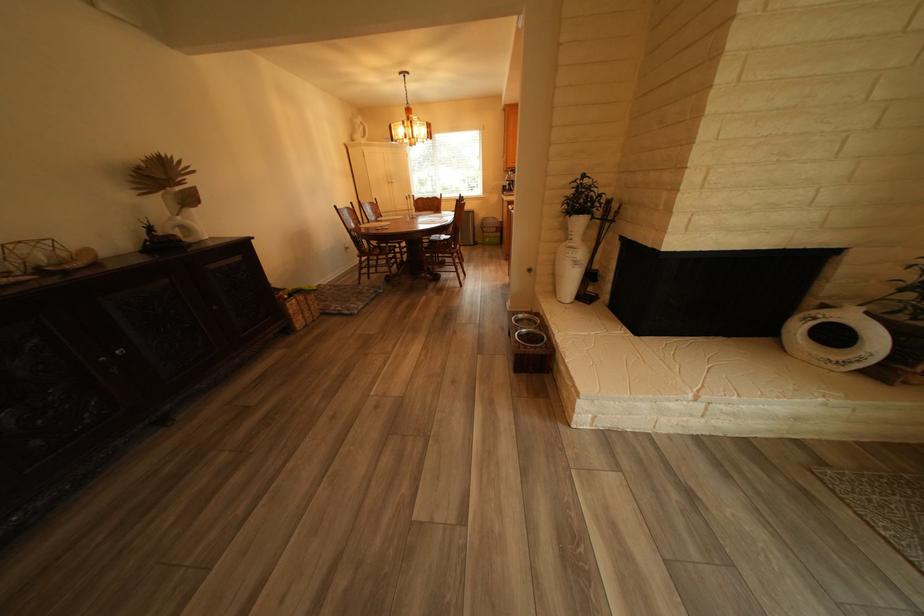
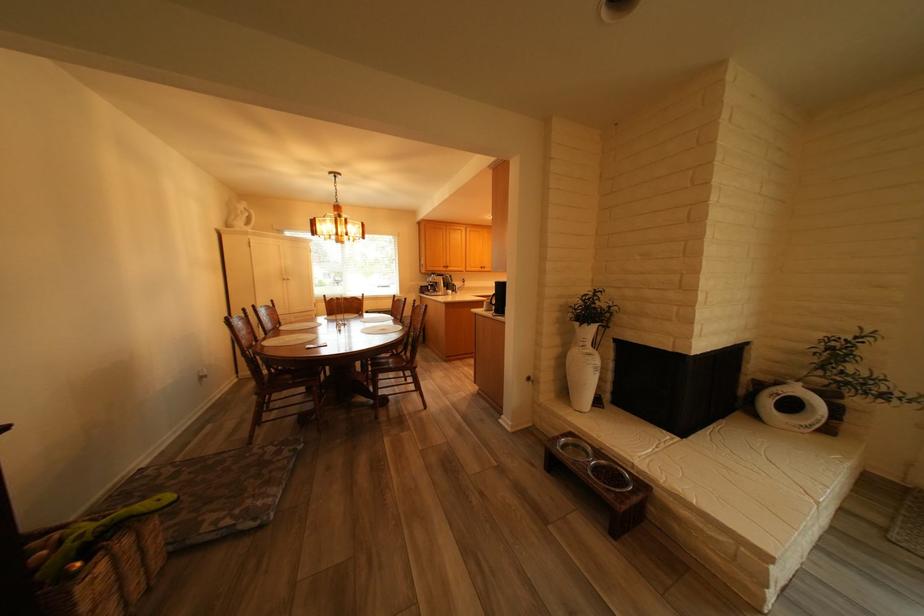
Find the pixel in the second image that matches the point at 533,336 in the first image.

(609, 477)